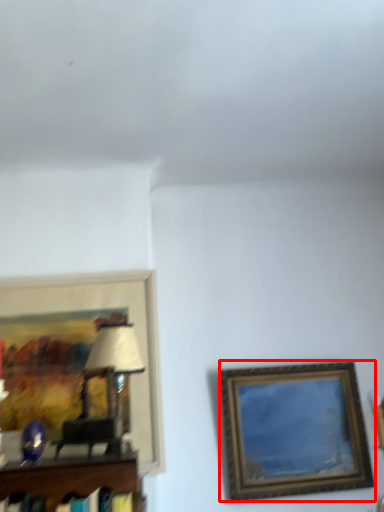
Question: Where is picture frame (annotated by the red box) located in relation to picture frame in the image?

Choices:
 (A) left
 (B) right

Answer: (B)